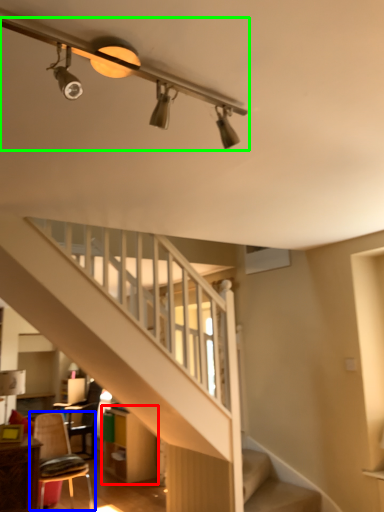
Question: Which object is the closest to the dresser (highlighted by a red box)? Choose among these: chair (highlighted by a blue box) or light fixture (highlighted by a green box).

Choices:
 (A) chair
 (B) light fixture

Answer: (A)